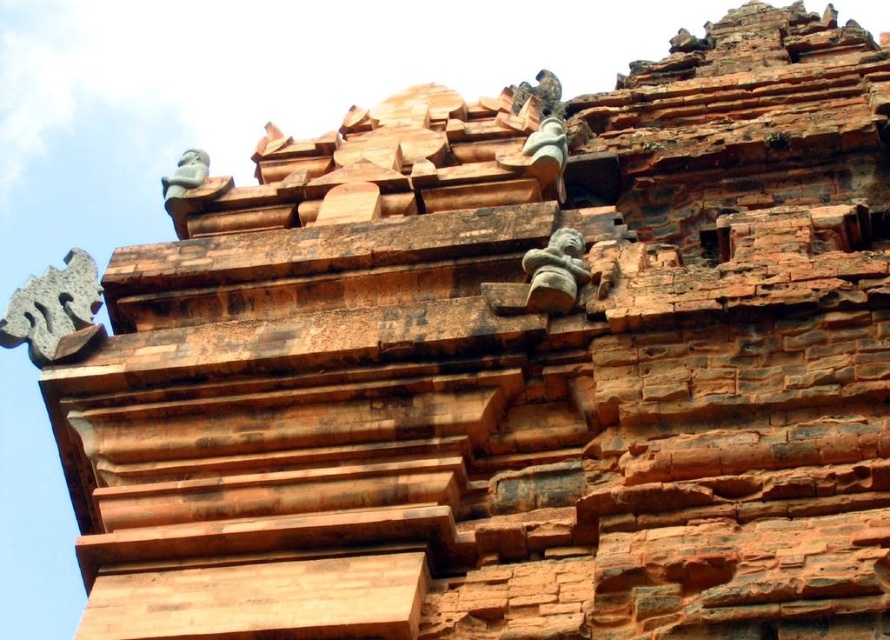
Question: Which object appears closest to the camera in this image?

Choices:
 (A) gray stone dragon at left
 (B) smooth stone figure at upper left
 (C) green stone figure at center

Answer: (C)

Question: Can you confirm if gray stone dragon at left is thinner than green stone figure at center?

Choices:
 (A) no
 (B) yes

Answer: (A)

Question: Estimate the real-world distances between objects in this image. Which object is farther from the smooth stone figure at upper left?

Choices:
 (A) green stone figure at center
 (B) gray stone dragon at left

Answer: (A)

Question: Which object is positioned closest to the smooth stone figure at upper left?

Choices:
 (A) green stone figure at center
 (B) gray stone dragon at left

Answer: (B)

Question: Is green stone figure at center to the left of smooth stone figure at upper left from the viewer's perspective?

Choices:
 (A) no
 (B) yes

Answer: (A)

Question: Is gray stone dragon at left above green stone figure at center?

Choices:
 (A) no
 (B) yes

Answer: (B)